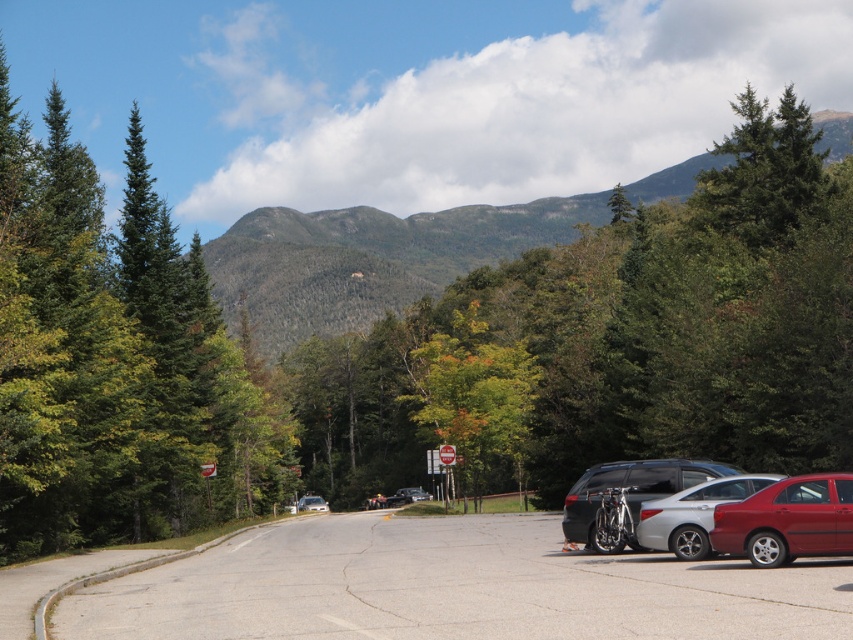
You are driving a car and want to park in the gray asphalt parking lot at center. However, there is a green evergreen tree at upper right nearby. Will the tree block your view of the parking lot?

The gray asphalt parking lot at center is in front of the green evergreen tree at upper right, so the tree will block your view of the parking lot.

You are driving a delivery van that is 2.5 meters wide and need to park in the gray asphalt parking lot at center. There is a green evergreen tree at upper right nearby. Can your van fit into the parking lot without hitting the tree?

The gray asphalt parking lot at center is positioned on the left side of the green evergreen tree at upper right. However, the description does not provide specific measurements about the parking lot dimensions or the distance from the tree, so it is uncertain if the van will fit without hitting the tree.

Consider the image. You are a hiker planning to walk from the shiny red sedan at lower right to the green forested mountain at upper center. The trail is straight and clear. If your average walking speed is 3 km per hour, how many minutes will it take you to reach the mountain?

The distance between the shiny red sedan at lower right and the green forested mountain at upper center is 150.96 meters. Converting meters to kilometers, it becomes 0.15096 km. Dividing this by your walking speed of 3 km per hour gives 0.05032 hours. Multiplying by 60 minutes, it takes approximately 3.02 minutes. Therefore, it will take roughly 3 minutes to reach the mountain.